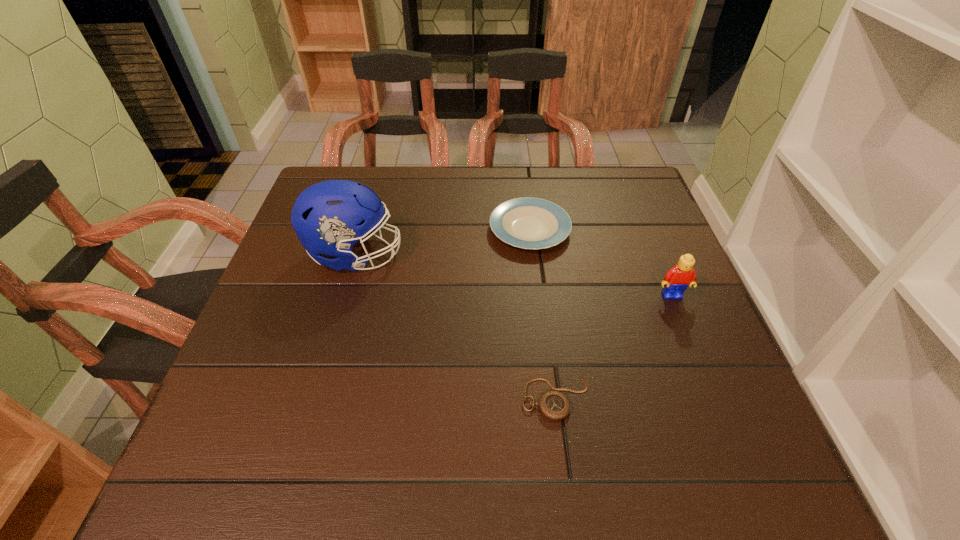
You are a GUI agent. You are given a task and a screenshot of the screen. Output one action in this format:
    pyautogui.click(x=<x>, y=<y>)
    Task: Click on the free space that is in between the leftmost object and the nearest object
    
    Given the screenshot: What is the action you would take?
    pyautogui.click(x=456, y=326)

Find the location of a particular element. free spot between the nearest object and the second nearest object is located at coordinates (613, 346).

Identify the location of vacant area that lies between the rightmost object and the tallest object. (514, 275).

You are a GUI agent. You are given a task and a screenshot of the screen. Output one action in this format:
    pyautogui.click(x=<x>, y=<y>)
    Task: Click on the vacant area that lies between the plate and the pocket watch
    
    Given the screenshot: What is the action you would take?
    pyautogui.click(x=542, y=313)

Locate an element on the screen. empty space between the plate and the tallest object is located at coordinates (443, 242).

This screenshot has height=540, width=960. I want to click on free area in between the plate and the Lego, so click(x=601, y=262).

At what (x,y) coordinates should I click in order to perform the action: click on free area in between the tallest object and the rightmost object. Please return your answer as a coordinate pair (x, y). Looking at the image, I should click on (514, 275).

Where is `free space that is in between the tallest object and the shortest object`? free space that is in between the tallest object and the shortest object is located at coordinates (456, 326).

Identify the location of the closest object to the football helmet. (530, 223).

Choose which object is the second nearest neighbor to the third farthest object. Please provide its 2D coordinates. Your answer should be formatted as a tuple, i.e. [(x, y)], where the tuple contains the x and y coordinates of a point satisfying the conditions above.

[(553, 405)]